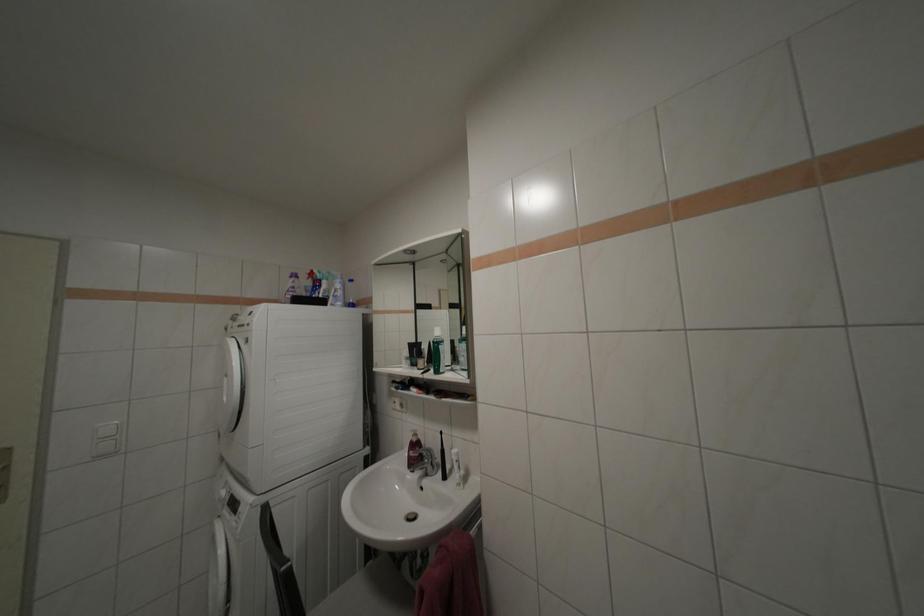
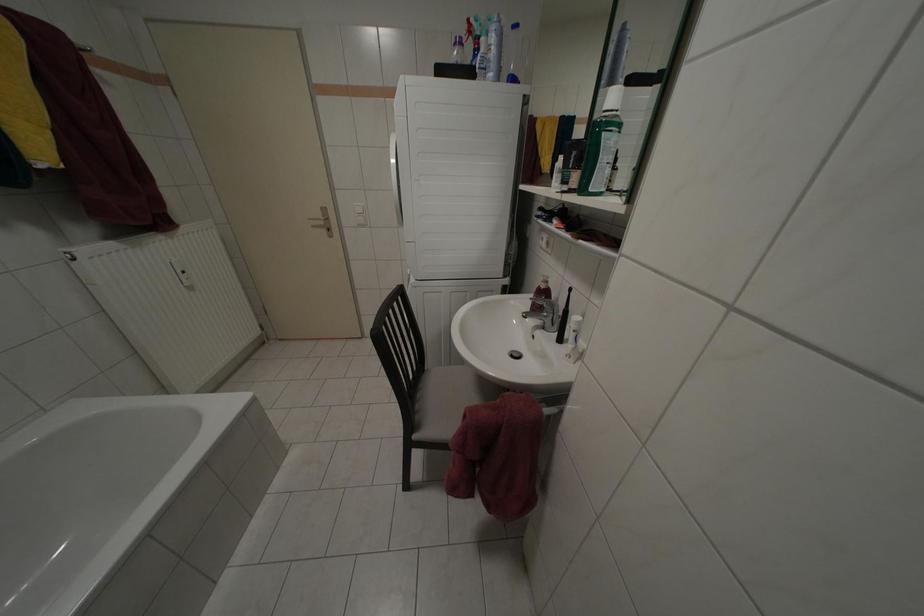
How did the camera likely rotate?

The rotation direction of the camera is left-down.